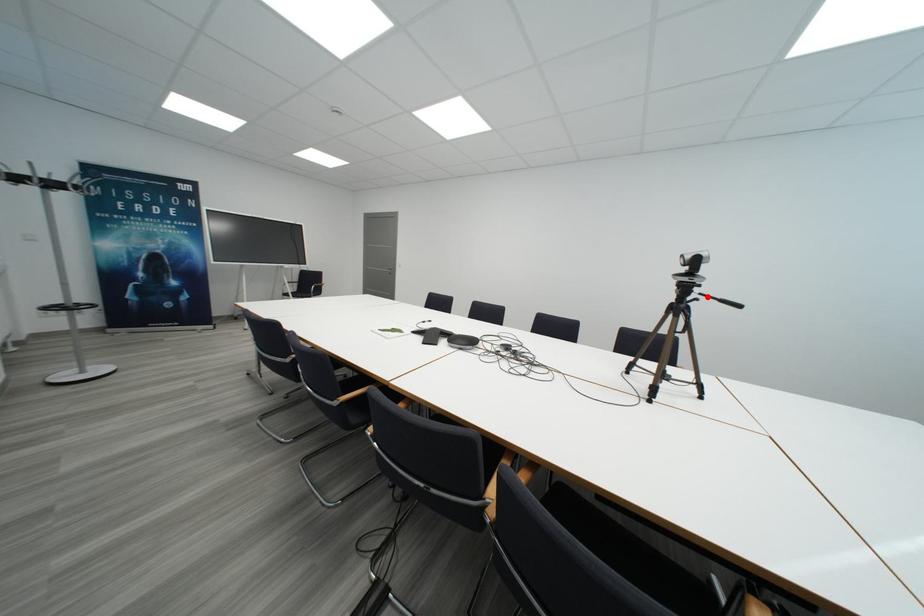
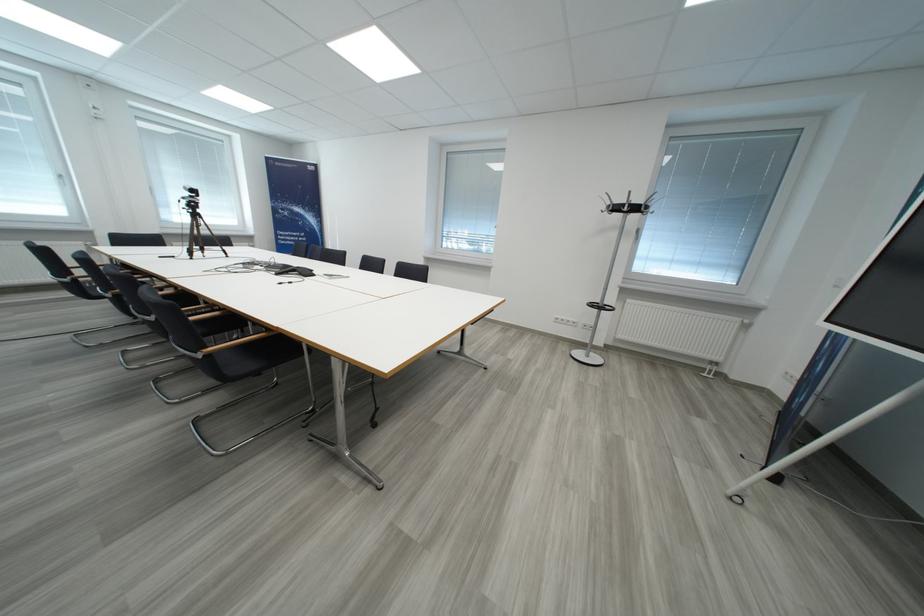
Question: I am providing you with two images of the same scene from different viewpoints. A red point is marked on the first image. Is the red point's position out of view in image 2?

Choices:
 (A) Yes
 (B) No

Answer: (A)